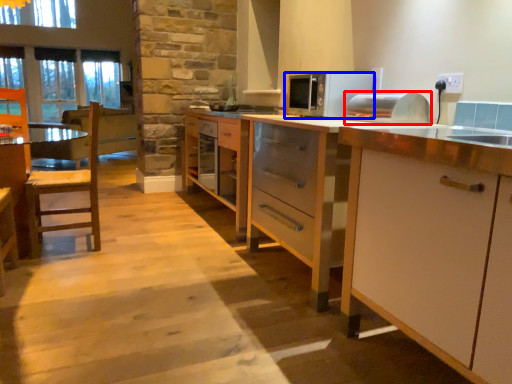
Question: Which of the following is the closest to the observer, appliance (highlighted by a red box) or microwave oven (highlighted by a blue box)?

Choices:
 (A) appliance
 (B) microwave oven

Answer: (A)